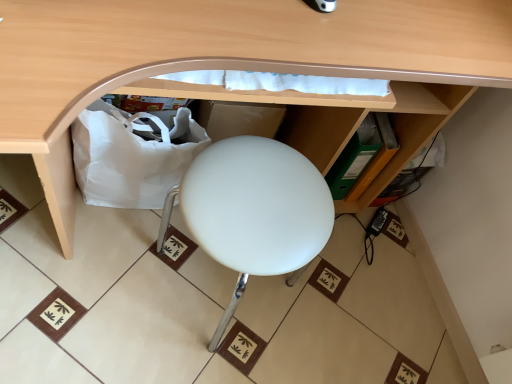
What is the approximate width of white fabric bag at lower left?

16.54 centimeters.

This screenshot has width=512, height=384. What are the coordinates of `matte wood desk at center` in the screenshot? It's located at (225, 58).

This screenshot has height=384, width=512. I want to click on white matte stool at center, so click(x=253, y=211).

Locate an element on the screen. Image resolution: width=512 pixels, height=384 pixels. furniture to the right of white fabric bag at lower left is located at coordinates (253, 211).

Which is behind, point (228, 216) or point (147, 141)?

Positioned behind is point (147, 141).

Considering the relative positions of white matte stool at center and white fabric bag at lower left in the image provided, is white matte stool at center to the left of white fabric bag at lower left from the viewer's perspective?

Incorrect, white matte stool at center is not on the left side of white fabric bag at lower left.

Does white matte stool at center turn towards white fabric bag at lower left?

No, white matte stool at center does not turn towards white fabric bag at lower left.

Considering the relative positions of matte wood desk at center and white matte stool at center in the image provided, is matte wood desk at center to the left or to the right of white matte stool at center?

matte wood desk at center is to the right of white matte stool at center.

Which of these two, matte wood desk at center or white matte stool at center, is smaller?

white matte stool at center is smaller.

Is matte wood desk at center outside of white matte stool at center?

Absolutely, matte wood desk at center is external to white matte stool at center.

From the image's perspective, between matte wood desk at center and white matte stool at center, which one is located above?

matte wood desk at center is shown above in the image.

Is white fabric bag at lower left to the left of matte wood desk at center from the viewer's perspective?

Yes.

Is white fabric bag at lower left not inside matte wood desk at center?

No, white fabric bag at lower left is inside matte wood desk at center's boundary.

Could you tell me if white fabric bag at lower left is facing matte wood desk at center?

Yes, white fabric bag at lower left faces towards matte wood desk at center.

Which of these two, white fabric bag at lower left or matte wood desk at center, is bigger?

Bigger between the two is matte wood desk at center.

Between matte wood desk at center and white fabric bag at lower left, which one has smaller width?

white fabric bag at lower left.

Can you confirm if matte wood desk at center is bigger than white fabric bag at lower left?

Yes.

Considering the sizes of objects matte wood desk at center and white fabric bag at lower left in the image provided, who is taller, matte wood desk at center or white fabric bag at lower left?

With more height is matte wood desk at center.

Is matte wood desk at center directly adjacent to white fabric bag at lower left?

No, matte wood desk at center is not next to white fabric bag at lower left.

From the image's perspective, is white fabric bag at lower left below white matte stool at center?

Actually, white fabric bag at lower left appears above white matte stool at center in the image.

Can you confirm if white fabric bag at lower left is bigger than white matte stool at center?

Actually, white fabric bag at lower left might be smaller than white matte stool at center.

Which of these two, white fabric bag at lower left or white matte stool at center, is thinner?

Thinner between the two is white fabric bag at lower left.

How many degrees apart are the facing directions of white fabric bag at lower left and white matte stool at center?

white fabric bag at lower left and white matte stool at center are facing 0.719 degrees away from each other.

From the picture: Is white matte stool at center not close to matte wood desk at center?

No.

Is white matte stool at center turned away from matte wood desk at center?

Correct, white matte stool at center is looking away from matte wood desk at center.

Considering the sizes of objects white matte stool at center and matte wood desk at center in the image provided, who is wider, white matte stool at center or matte wood desk at center?

Wider between the two is matte wood desk at center.

Looking at this image, from the image's perspective, relative to matte wood desk at center, is white matte stool at center above or below?

white matte stool at center is below matte wood desk at center.

Locate an element on the screen. This screenshot has width=512, height=384. paper bag behind the white matte stool at center is located at coordinates [x=132, y=155].

Find the location of a particular element. furniture below the matte wood desk at center (from the image's perspective) is located at coordinates (253, 211).

Considering their positions, is white fabric bag at lower left positioned closer to white matte stool at center than matte wood desk at center?

white fabric bag at lower left.

Looking at the image, which one is located closer to matte wood desk at center, white matte stool at center or white fabric bag at lower left?

white matte stool at center lies closer to matte wood desk at center than the other object.

Based on their spatial positions, is matte wood desk at center or white fabric bag at lower left closer to white matte stool at center?

The object closer to white matte stool at center is white fabric bag at lower left.

Based on their spatial positions, is white fabric bag at lower left or white matte stool at center closer to matte wood desk at center?

white matte stool at center is closer to matte wood desk at center.

Based on their spatial positions, is white matte stool at center or matte wood desk at center further from white fabric bag at lower left?

matte wood desk at center.

Consider the image. From the image, which object appears to be farther from white fabric bag at lower left, matte wood desk at center or white matte stool at center?

matte wood desk at center is positioned further to the anchor white fabric bag at lower left.

At what (x,y) coordinates should I click in order to perform the action: click on furniture between matte wood desk at center and white fabric bag at lower left from front to back. Please return your answer as a coordinate pair (x, y). The image size is (512, 384). Looking at the image, I should click on (253, 211).